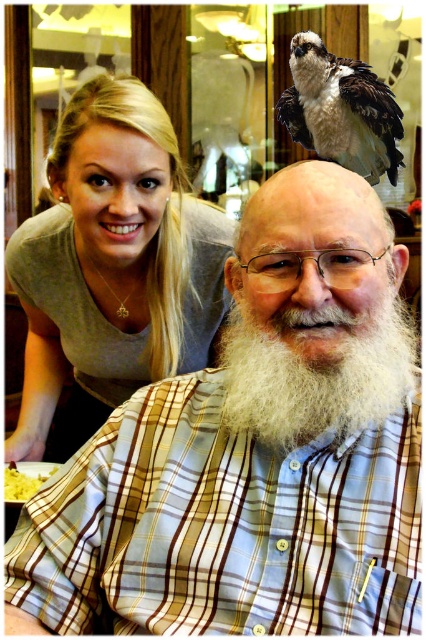
Question: Which of the following is the farthest from the observer?

Choices:
 (A) brown speckled feathers at upper right
 (B) white fluffy beard at center
 (C) yellow mashed potatoes at lower left
 (D) plaid shirt at center

Answer: (A)

Question: Does white fluffy beard at center have a lesser width compared to yellow mashed potatoes at lower left?

Choices:
 (A) yes
 (B) no

Answer: (B)

Question: Does plaid shirt at center appear over yellow mashed potatoes at lower left?

Choices:
 (A) yes
 (B) no

Answer: (A)

Question: Can you confirm if plaid shirt at center is positioned to the right of brown speckled feathers at upper right?

Choices:
 (A) yes
 (B) no

Answer: (B)

Question: Which point is farther from the camera taking this photo?

Choices:
 (A) (157, 397)
 (B) (397, 305)
 (C) (186, 220)

Answer: (C)

Question: Which object is closer to the camera taking this photo?

Choices:
 (A) yellow mashed potatoes at lower left
 (B) white fluffy beard at center
 (C) plaid shirt at center

Answer: (C)